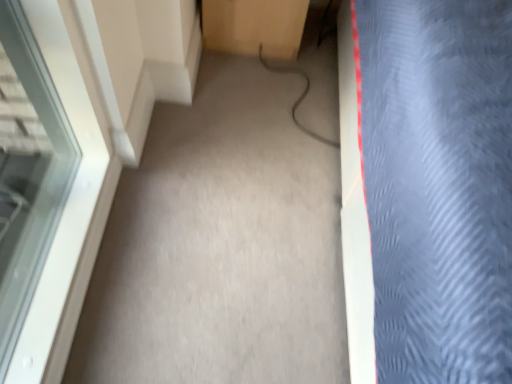
Where is `blue textured fabric at right`? This screenshot has width=512, height=384. blue textured fabric at right is located at coordinates (438, 185).

The width and height of the screenshot is (512, 384). Describe the element at coordinates (438, 185) in the screenshot. I see `blue textured fabric at right` at that location.

Locate an element on the screen. The image size is (512, 384). blue textured fabric at right is located at coordinates (438, 185).